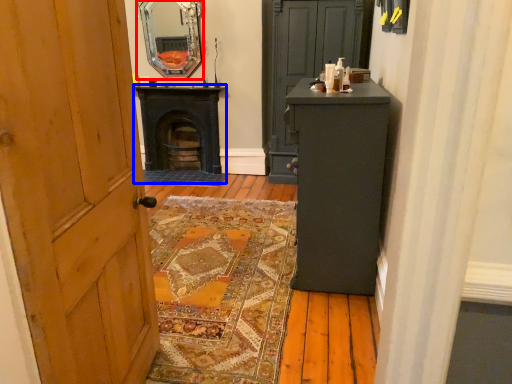
Question: Which object is closer to the camera taking this photo, mirror (highlighted by a red box) or stove (highlighted by a blue box)?

Choices:
 (A) mirror
 (B) stove

Answer: (A)